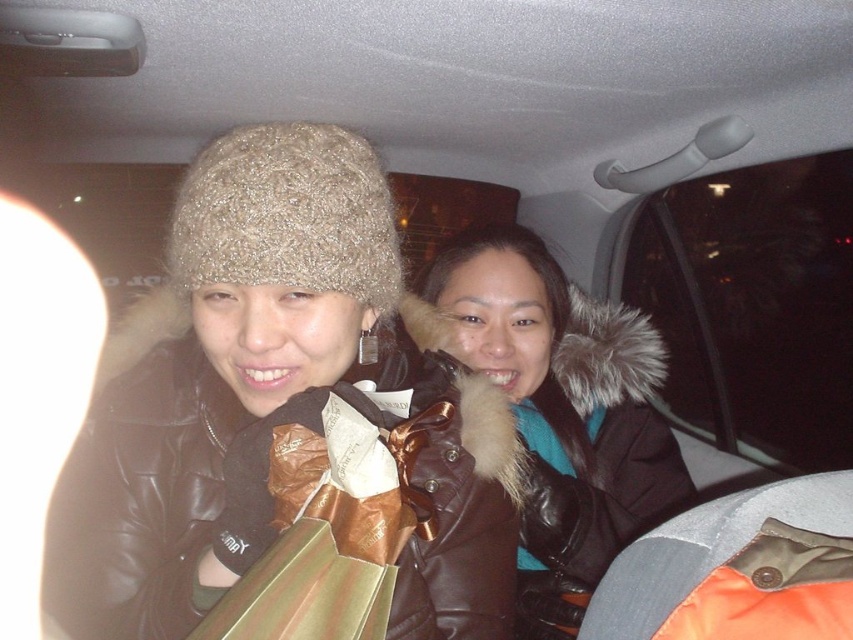
You are a fashion designer observing the car interior scene. You need to determine which item, the brown leather jacket at center or the orange fabric at lower right, is taller in the image. Which one is taller?

The brown leather jacket at center is taller than the orange fabric at lower right.

You are a delivery person who needs to place a 12 inch package between the knitted woolen hat at upper left and the brown leather jacket at center in the car. Can the package fit in the space between them?

The distance between the knitted woolen hat at upper left and the brown leather jacket at center is 24.49 inches. Since the package is 12 inches long, it can fit comfortably within the available space.

You are a photographer trying to capture the brown leather jacket at center in the image. The camera has a focus point at coordinates 0.65, 0.65. Is the jacket within the focus area?

The brown leather jacket at center is located at coordinates (564, 412), which is very close to the camera focus point at (554, 416). The slight difference in coordinates means the jacket is just outside the focus area.